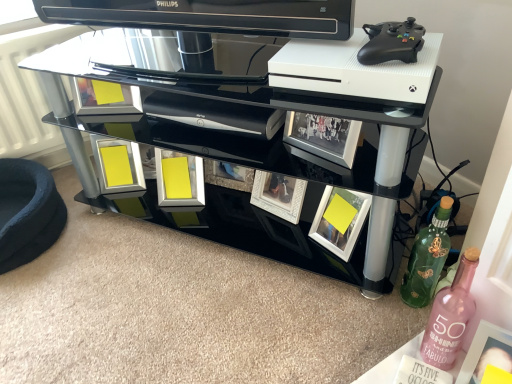
At what (x,y) coordinates should I click in order to perform the action: click on free space to the left of green matte bottle at lower right, acting as the second bottle starting from the front. Please return your answer as a coordinate pair (x, y). Image resolution: width=512 pixels, height=384 pixels. Looking at the image, I should click on (360, 312).